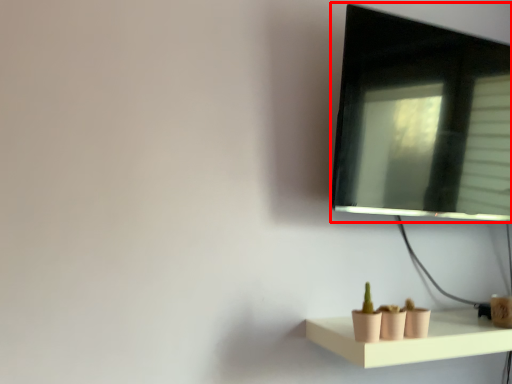
Question: Where is computer monitor (annotated by the red box) located in relation to shelf in the image?

Choices:
 (A) right
 (B) left

Answer: (A)